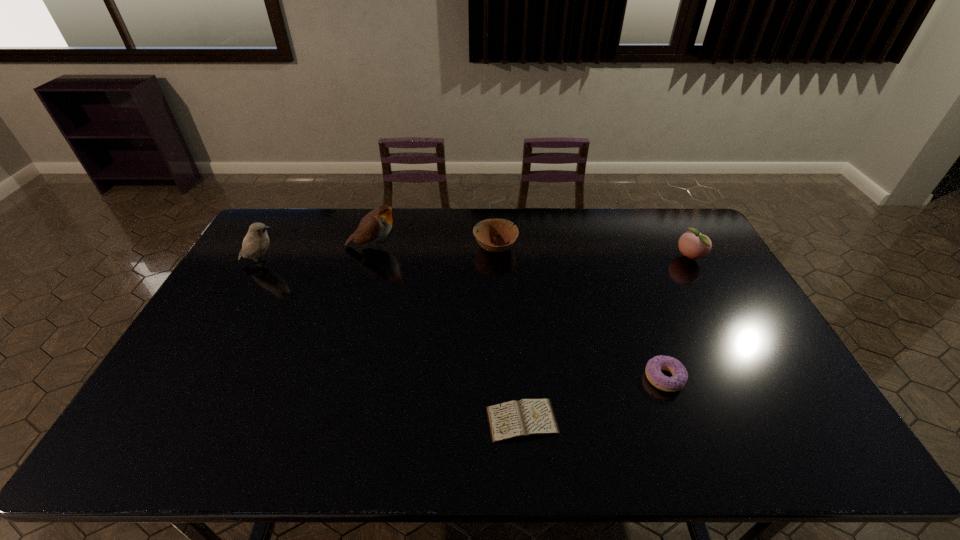
Locate an element on the screen. object that is at the left edge is located at coordinates (256, 242).

The width and height of the screenshot is (960, 540). I want to click on object at the right edge, so click(x=694, y=245).

I want to click on vacant space at the far edge of the desktop, so click(x=356, y=226).

Find the location of `vacant space at the near edge of the desktop`. vacant space at the near edge of the desktop is located at coordinates (599, 429).

The image size is (960, 540). I want to click on free space at the left edge of the desktop, so click(x=237, y=314).

In order to click on vacant area at the right edge in this screenshot , I will do click(710, 275).

I want to click on free space at the far left corner of the desktop, so click(280, 229).

The height and width of the screenshot is (540, 960). I want to click on free location at the near right corner of the desktop, so click(x=828, y=439).

The image size is (960, 540). What are the coordinates of `vacant area that lies between the fourth shortest object and the left bird` in the screenshot? It's located at (476, 260).

The image size is (960, 540). Identify the location of free space between the fifth tallest object and the left bird. (464, 321).